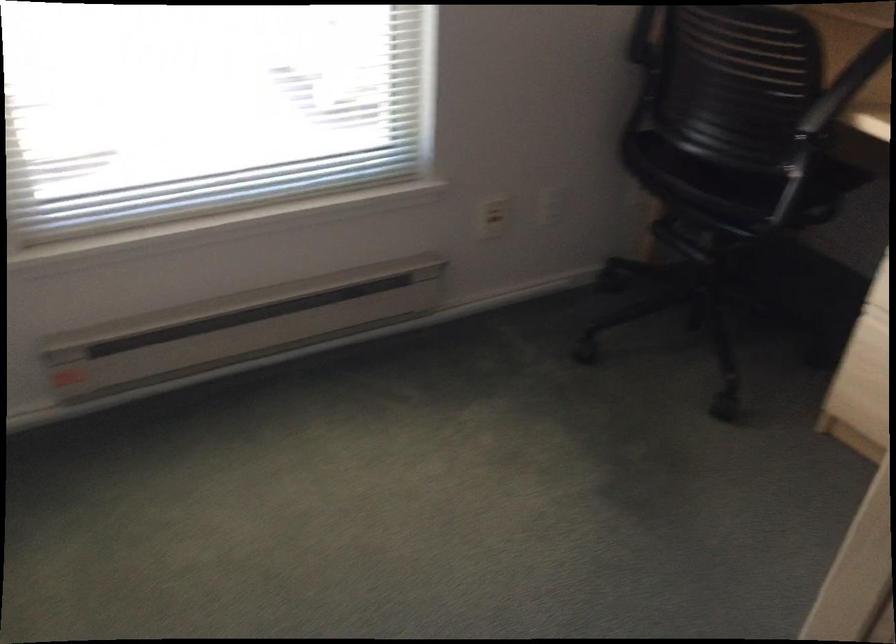
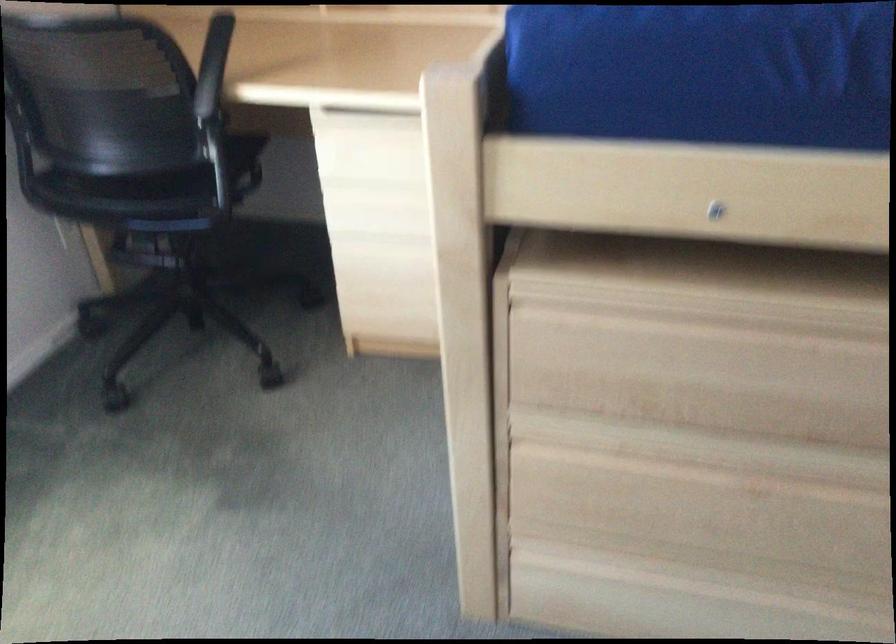
Question: The camera is either moving clockwise (left) or counter-clockwise (right) around the object. The first image is from the beginning of the video and the second image is from the end. Is the camera moving left or right when shooting the video?

Choices:
 (A) Left
 (B) Right

Answer: (A)